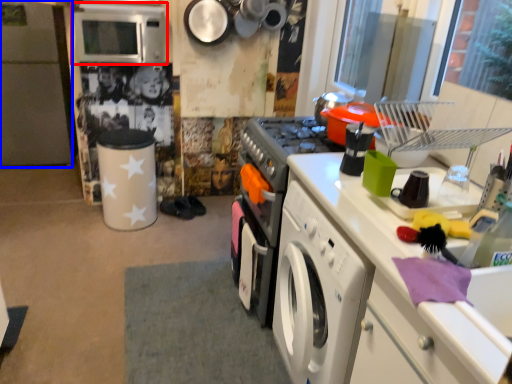
Question: Which of the following is the farthest to the observer, microwave oven (highlighted by a red box) or fridge (highlighted by a blue box)?

Choices:
 (A) microwave oven
 (B) fridge

Answer: (B)